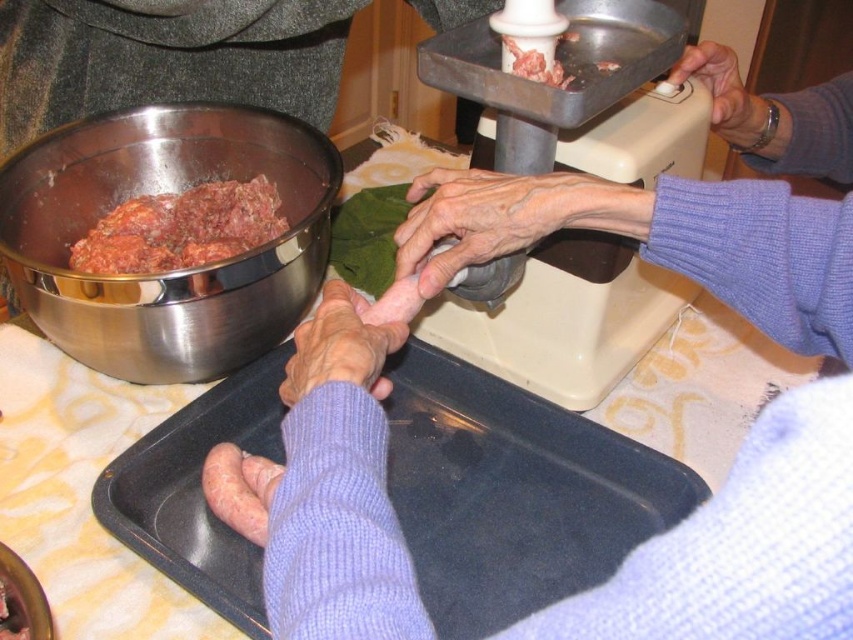
Between shiny metallic bowl at left and dark red textured meat at left, which one appears on the right side from the viewer's perspective?

Positioned to the right is shiny metallic bowl at left.

Which of these two, shiny metallic bowl at left or dark red textured meat at left, stands taller?

Standing taller between the two is shiny metallic bowl at left.

Image resolution: width=853 pixels, height=640 pixels. Find the location of `shiny metallic bowl at left`. shiny metallic bowl at left is located at coordinates pos(173,272).

Identify the location of shiny metallic bowl at left. The height and width of the screenshot is (640, 853). (173, 272).

Measure the distance from purple ribbed sweater at center to pinkish smooth sausage at lower left.

purple ribbed sweater at center is 7.14 inches from pinkish smooth sausage at lower left.

Is purple ribbed sweater at center to the left of pinkish smooth sausage at lower left from the viewer's perspective?

No, purple ribbed sweater at center is not to the left of pinkish smooth sausage at lower left.

Is point (344, 513) behind point (221, 486)?

That is False.

This screenshot has width=853, height=640. Identify the location of purple ribbed sweater at center. (741, 545).

Can you confirm if dark red textured meat at left is thinner than smooth beige hand at upper right?

Incorrect, dark red textured meat at left's width is not less than smooth beige hand at upper right's.

You are a GUI agent. You are given a task and a screenshot of the screen. Output one action in this format:
    pyautogui.click(x=<x>, y=<y>)
    Task: Click on the dark red textured meat at left
    
    Given the screenshot: What is the action you would take?
    pyautogui.click(x=181, y=228)

The height and width of the screenshot is (640, 853). Identify the location of dark red textured meat at left. (181, 228).